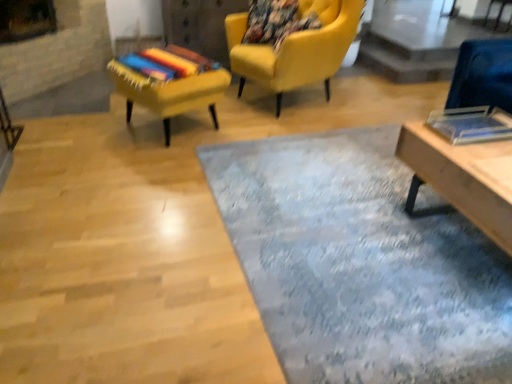
Find the location of a particular element. blank area beneath textured blue rug at center (from a real-world perspective) is located at coordinates (334, 218).